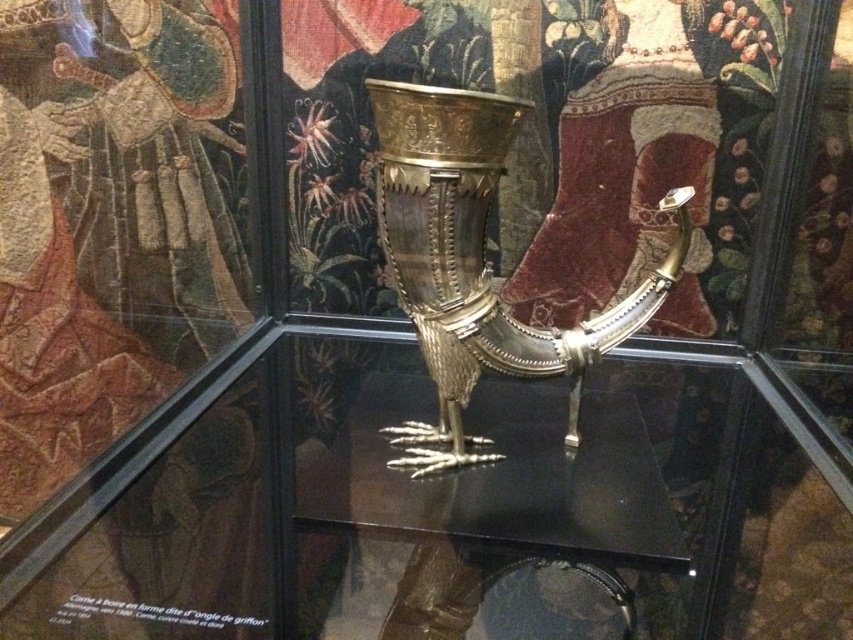
You are a visitor at a museum and see the transparent glass table at center and the gold metallic goblet at center. Which object is positioned to the left side of the other?

The transparent glass table at center is positioned to the left of the gold metallic goblet at center.

You are a museum visitor standing in front of the glass case. You notice the transparent glass table at center and the gold metallic goblet at center. Which object is closer to you?

The transparent glass table at center is closer to the viewer than the gold metallic goblet at center.